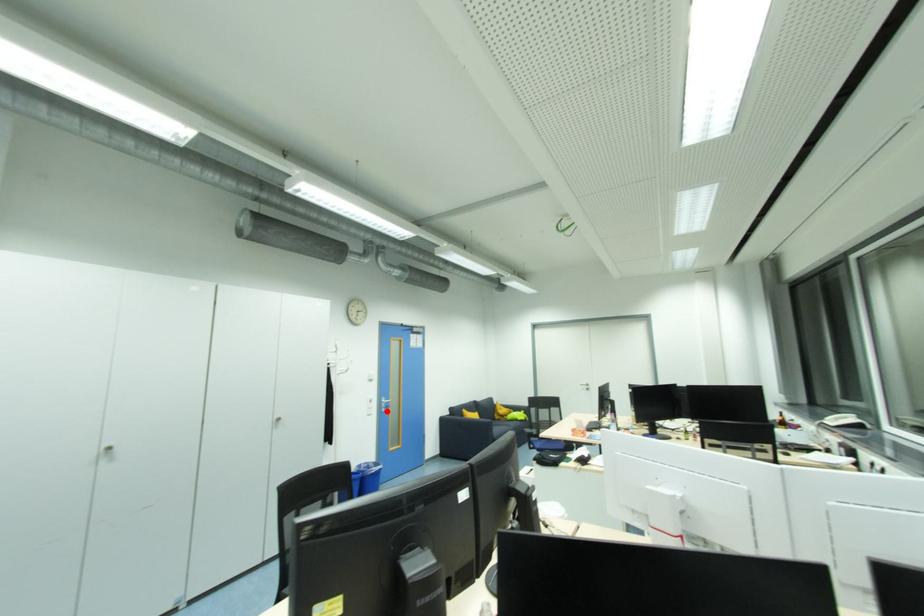
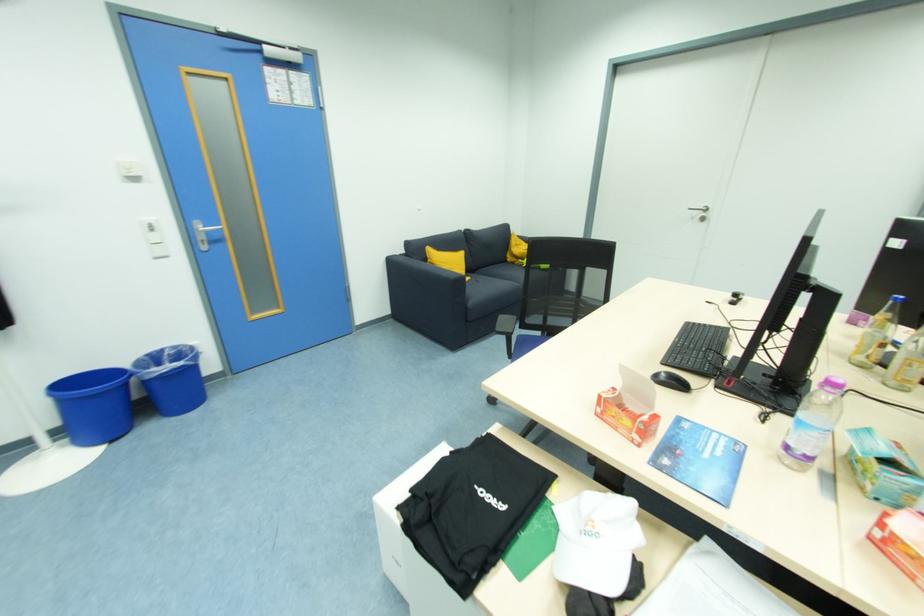
Question: I am providing you with two images of the same scene from different viewpoints. Image1 has a red point marked. In image2, the corresponding 3D location appears at what relative position? Reply with the corresponding letter.

Choices:
 (A) Closer
 (B) Farther

Answer: (A)